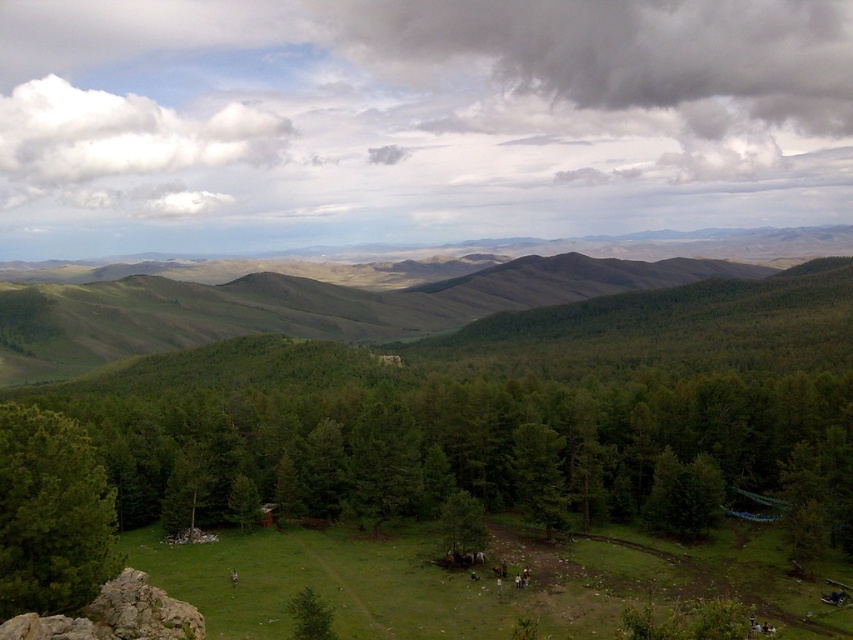
You are planning to set up a tent for a camping trip and need to choose between the cloudy sky at upper center or the green matte tree at lower center as a reference point for your tent location. Which reference point is closer to you?

The green matte tree at lower center is closer to you because the cloudy sky at upper center is further away from the viewer.

You are planning a picnic and want to set up your blanket on the green grassy field at lower center. However, you are concerned about rain. Based on the scene, is the cloudy sky at upper center likely to bring rain soon?

The cloudy sky at upper center is positioned over the green grassy field at lower center, but the scene describes the sky as partly cloudy and the overall landscape as serene. There is no indication of stormy weather or heavy clouds, so it is unlikely to rain soon.

You are an astronomer trying to determine the best spot to set up a telescope in the meadow. Considering the cloudy sky at upper center, where would you place the telescope to avoid its obstruction?

The cloudy sky at upper center is located at point (415, 120), so to avoid obstruction, the telescope should be positioned away from that area, possibly to the lower left or right side of the meadow where the sky is clearer.